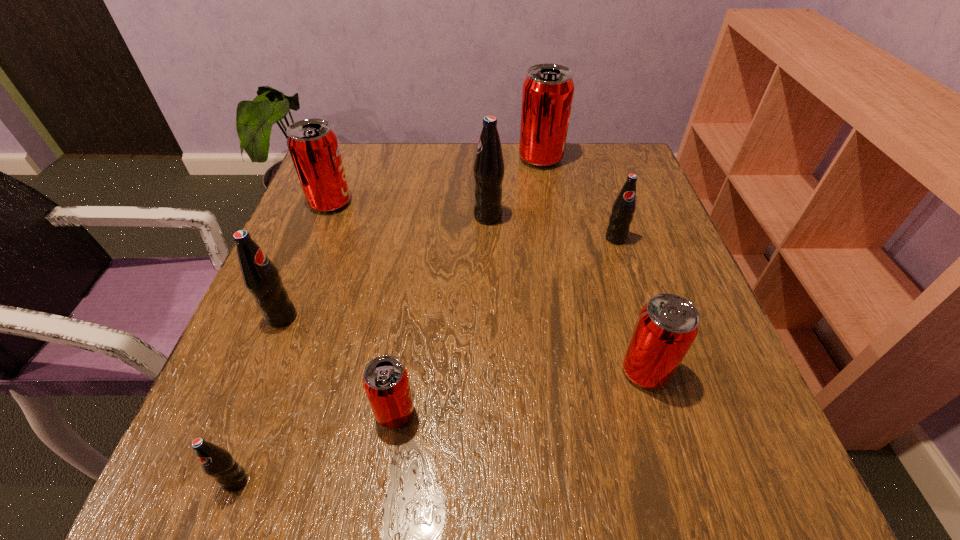
Where is `vacant space at the right edge of the desktop`? vacant space at the right edge of the desktop is located at coordinates (686, 398).

You are a GUI agent. You are given a task and a screenshot of the screen. Output one action in this format:
    pyautogui.click(x=<x>, y=<y>)
    Task: Click on the free location at the far left corner of the desktop
    This screenshot has width=960, height=540.
    Given the screenshot: What is the action you would take?
    pyautogui.click(x=350, y=173)

At what (x,y) coordinates should I click in order to perform the action: click on empty space that is in between the biggest black pop and the third smallest red soda can. Please return your answer as a coordinate pair (x, y). Image resolution: width=960 pixels, height=540 pixels. Looking at the image, I should click on coord(409,210).

Identify the location of free space between the biggest red soda can and the second nearest red soda can. (593, 265).

Identify the location of vacant region between the fourth pop from left to right and the third smallest red soda can. (363, 308).

The width and height of the screenshot is (960, 540). Find the location of `free space that is in between the second biggest red soda can and the fifth farthest object`. free space that is in between the second biggest red soda can and the fifth farthest object is located at coordinates (306, 260).

At what (x,y) coordinates should I click in order to perform the action: click on free space between the fourth object from right to left and the third biggest red soda can. Please return your answer as a coordinate pair (x, y). This screenshot has height=540, width=960. Looking at the image, I should click on (566, 294).

At what (x,y) coordinates should I click in order to perform the action: click on free space between the third nearest red soda can and the nearest red soda can. Please return your answer as a coordinate pair (x, y). Looking at the image, I should click on (363, 308).

This screenshot has height=540, width=960. I want to click on free point between the rightmost black pop and the third nearest pop, so click(631, 305).

The image size is (960, 540). I want to click on free point between the third biggest black pop and the third smallest red soda can, so click(x=473, y=220).